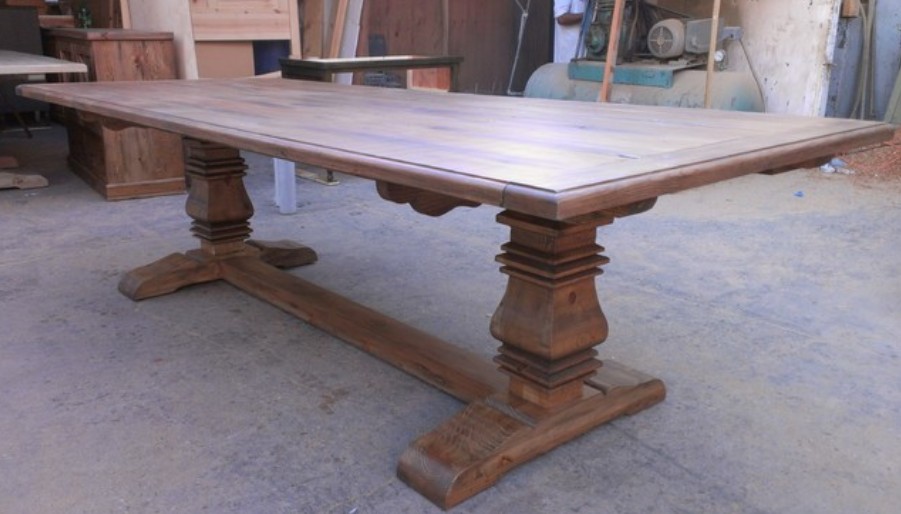
Find the location of a particular element. The image size is (901, 514). wooden dining room table is located at coordinates (393, 140).